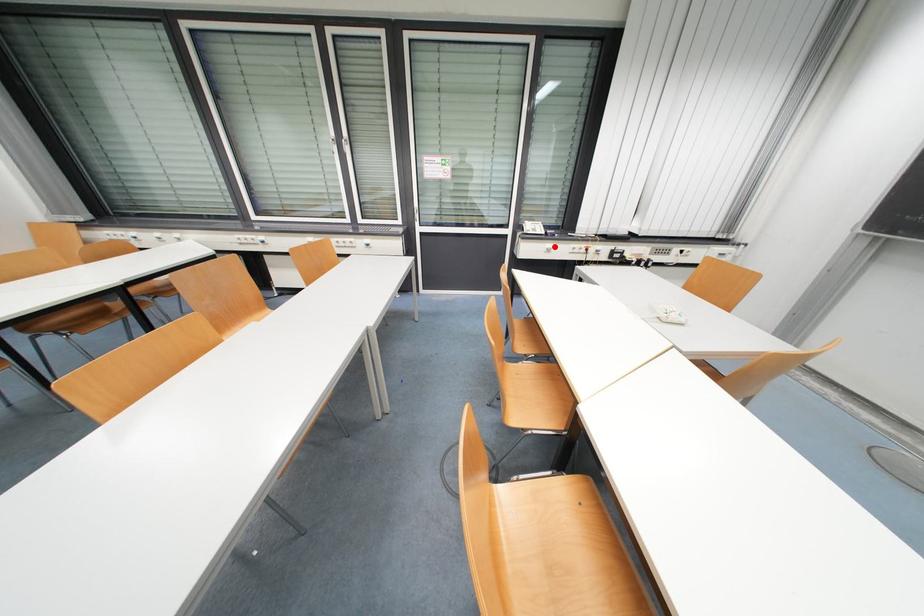
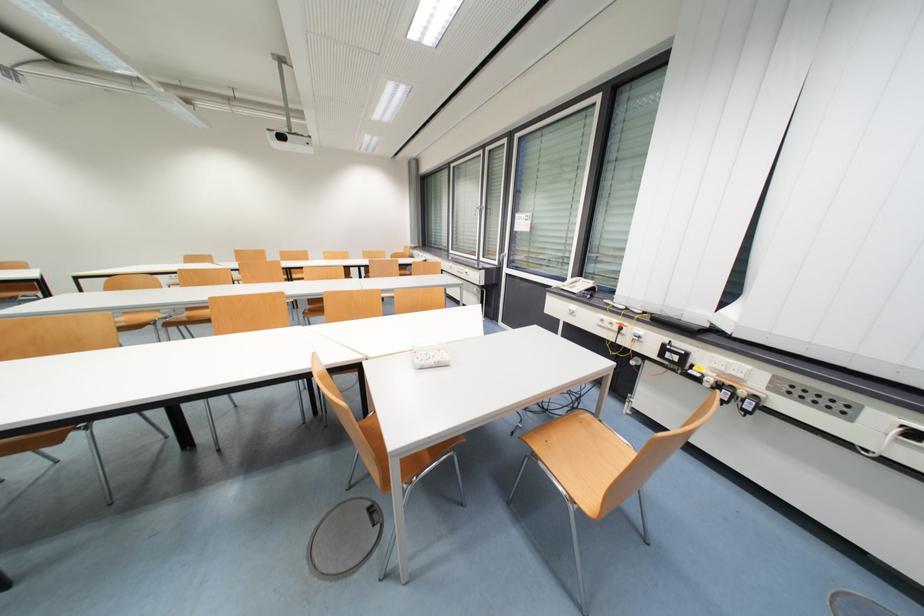
In the second image, find the point that corresponds to the highlighted location in the first image.

(578, 309)